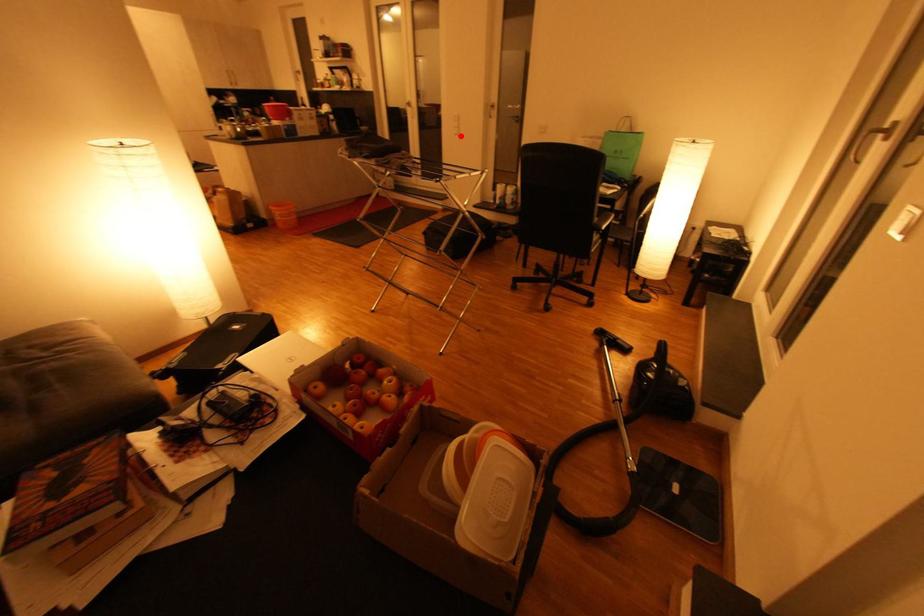
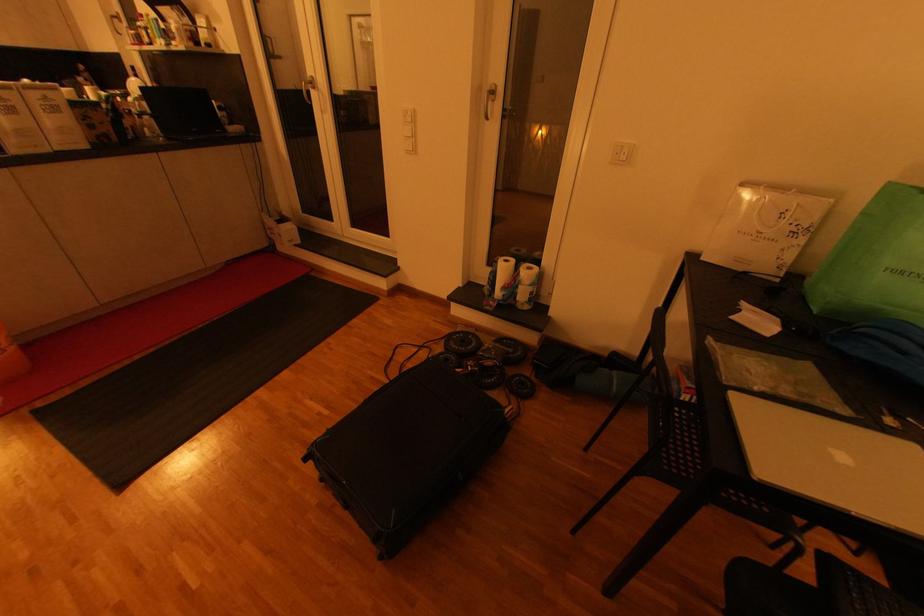
Find the pixel in the second image that matches the highlighted location in the first image.

(412, 153)